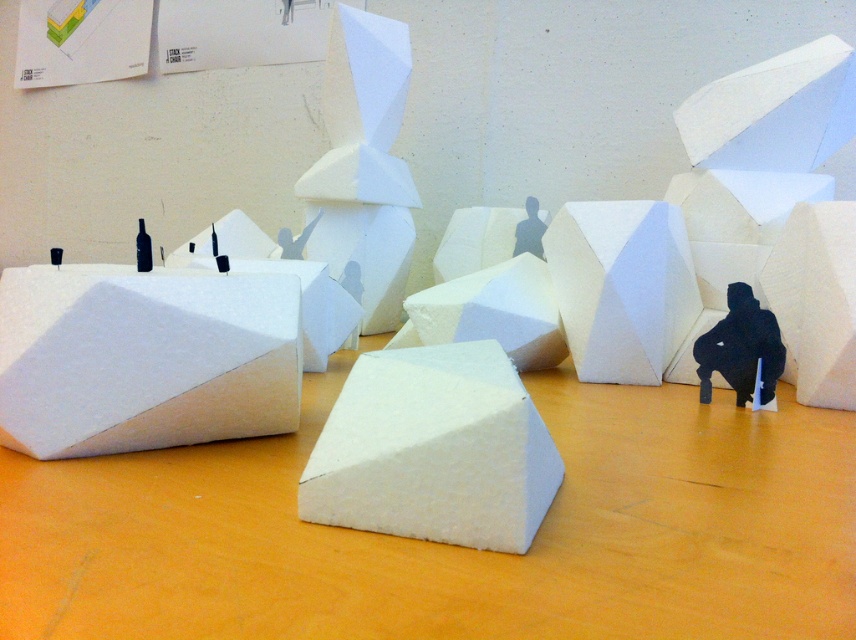
Question: Which point is closer to the camera?

Choices:
 (A) white matte hexagonal block at center-right
 (B) white matte foam block at left

Answer: (B)

Question: Can you confirm if white matte foam block at left is positioned below black matte figure at center?

Choices:
 (A) yes
 (B) no

Answer: (A)

Question: Is white matte foam block at center further to the viewer compared to white matte foam cube at lower right?

Choices:
 (A) no
 (B) yes

Answer: (A)

Question: Considering the real-world distances, which object is farthest from the white matte foam at center?

Choices:
 (A) black matte figure at center
 (B) black matte figure at lower right

Answer: (B)

Question: Can you confirm if white matte foam cube at lower right is wider than white matte foam at center?

Choices:
 (A) no
 (B) yes

Answer: (A)

Question: Which object appears closest to the camera in this image?

Choices:
 (A) white matte foam at center
 (B) black matte figure at center
 (C) white matte foam block at center
 (D) white matte table at center

Answer: (D)